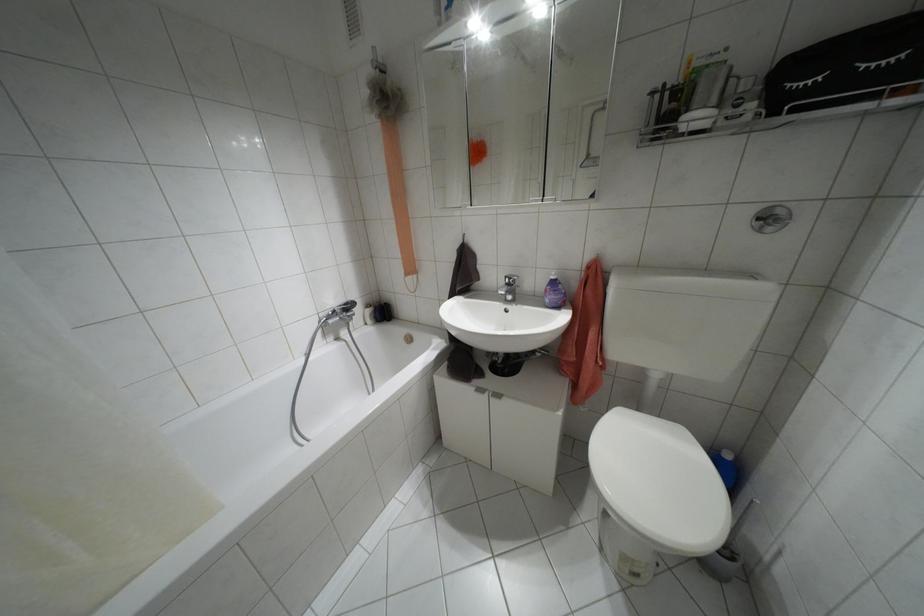
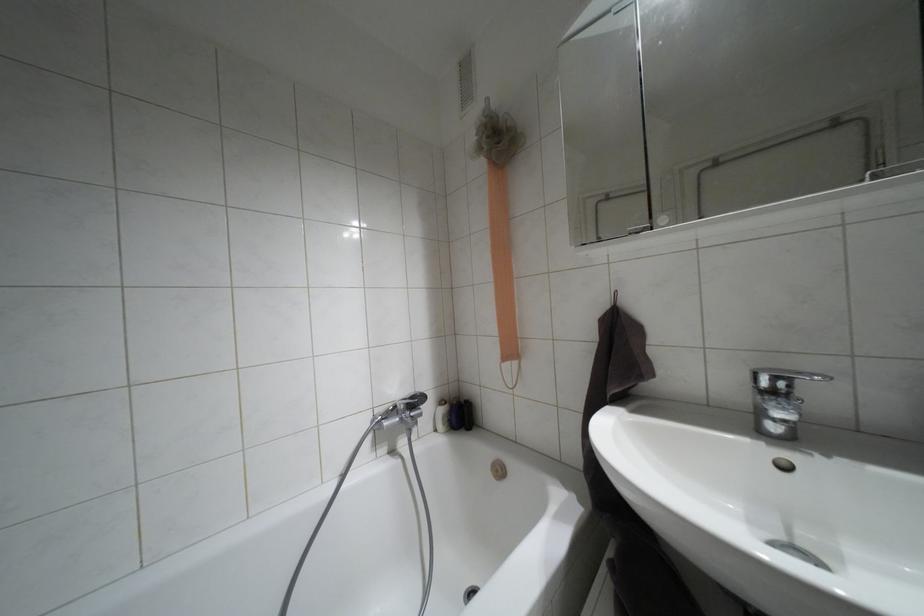
What movement of the cameraman would produce the second image?

The movement direction of the cameraman is left, forward.